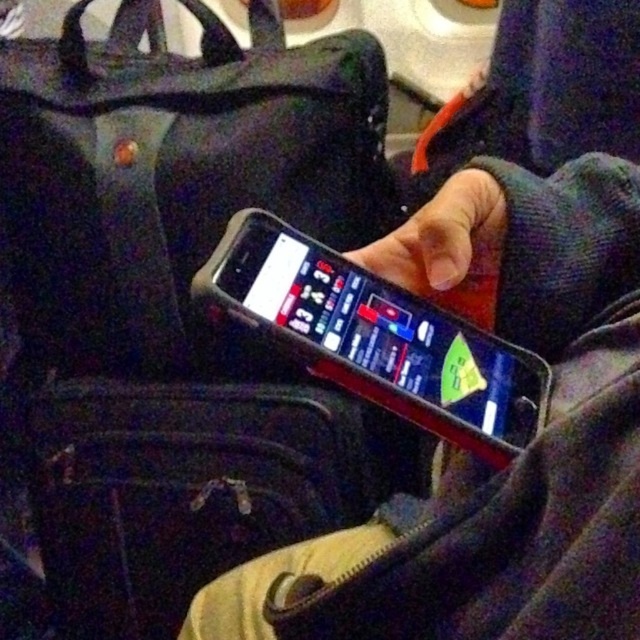
Who is higher up, black fabric suitcase at center or black rubberized smartphone at center?

Positioned higher is black rubberized smartphone at center.

Is point (147, 406) positioned behind point (500, 349)?

Yes.

Which is behind, point (164, 429) or point (250, 220)?

Positioned behind is point (164, 429).

Identify the location of black fabric suitcase at center. The image size is (640, 640). (195, 486).

Does black matte phone at center have a lesser height compared to black rubberized smartphone at center?

Incorrect, black matte phone at center's height does not fall short of black rubberized smartphone at center's.

Where is `black matte phone at center`? black matte phone at center is located at coordinates (520, 454).

I want to click on black matte phone at center, so click(x=520, y=454).

You are a GUI agent. You are given a task and a screenshot of the screen. Output one action in this format:
    pyautogui.click(x=<x>, y=<y>)
    Task: Click on the black matte phone at center
    
    Given the screenshot: What is the action you would take?
    pyautogui.click(x=520, y=454)

Between point (499, 541) and point (164, 401), which one is positioned in front?

Point (499, 541) is in front.

Where is `black matte phone at center`? The height and width of the screenshot is (640, 640). black matte phone at center is located at coordinates (520, 454).